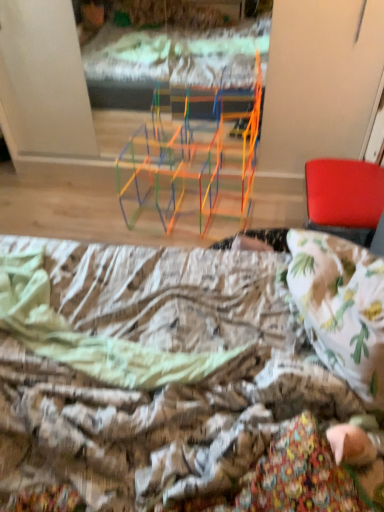
Image resolution: width=384 pixels, height=512 pixels. What are the coordinates of `red leather chair at right` in the screenshot? It's located at (344, 198).

What do you see at coordinates (344, 198) in the screenshot? I see `red leather chair at right` at bounding box center [344, 198].

What do you see at coordinates (165, 383) in the screenshot?
I see `printed fabric bed at lower center` at bounding box center [165, 383].

The image size is (384, 512). What are the coordinates of `printed fabric bed at lower center` in the screenshot? It's located at (165, 383).

At what (x,y) coordinates should I click in order to perform the action: click on red leather chair at right. Please return your answer as a coordinate pair (x, y). Image resolution: width=384 pixels, height=512 pixels. Looking at the image, I should click on (344, 198).

Is red leather chair at right at the left side of printed fabric bed at lower center?

In fact, red leather chair at right is to the right of printed fabric bed at lower center.

Which is in front, red leather chair at right or printed fabric bed at lower center?

printed fabric bed at lower center.

Is point (340, 216) in front of point (301, 355)?

No, (340, 216) is behind (301, 355).

From the image's perspective, between red leather chair at right and printed fabric bed at lower center, who is located below?

printed fabric bed at lower center, from the image's perspective.

From a real-world perspective, is red leather chair at right over printed fabric bed at lower center?

No, from a real-world perspective, red leather chair at right is not over printed fabric bed at lower center

Which of these two, red leather chair at right or printed fabric bed at lower center, is wider?

With larger width is printed fabric bed at lower center.

Who is taller, red leather chair at right or printed fabric bed at lower center?

red leather chair at right is taller.

Is red leather chair at right bigger than printed fabric bed at lower center?

No, red leather chair at right is not bigger than printed fabric bed at lower center.

Is red leather chair at right completely or partially outside of printed fabric bed at lower center?

Absolutely, red leather chair at right is external to printed fabric bed at lower center.

Are red leather chair at right and printed fabric bed at lower center beside each other?

No, red leather chair at right is not making contact with printed fabric bed at lower center.

Could you tell me if red leather chair at right is turned towards printed fabric bed at lower center?

No, red leather chair at right is not aimed at printed fabric bed at lower center.

How different are the orientations of red leather chair at right and printed fabric bed at lower center in degrees?

They differ by 7.71 degrees in their facing directions.

How much distance is there between red leather chair at right and printed fabric bed at lower center?

The distance of red leather chair at right from printed fabric bed at lower center is 28.86 inches.

Locate an element on the screen. Image resolution: width=384 pixels, height=512 pixels. bed in front of the red leather chair at right is located at coordinates (165, 383).

In the scene shown: Considering the positions of objects printed fabric bed at lower center and red leather chair at right in the image provided, who is more to the right, printed fabric bed at lower center or red leather chair at right?

red leather chair at right.

Is printed fabric bed at lower center closer to camera compared to red leather chair at right?

That is True.

Which is behind, point (46, 247) or point (314, 210)?

The point (314, 210) is behind.

Consider the image. From the image's perspective, is printed fabric bed at lower center below red leather chair at right?

Indeed, from the image's perspective, printed fabric bed at lower center is shown beneath red leather chair at right.

From a real-world perspective, which is physically above, printed fabric bed at lower center or red leather chair at right?

printed fabric bed at lower center is physically above.

Which object is thinner, printed fabric bed at lower center or red leather chair at right?

Thinner between the two is red leather chair at right.

Considering the sizes of printed fabric bed at lower center and red leather chair at right in the image, is printed fabric bed at lower center taller or shorter than red leather chair at right?

Clearly, printed fabric bed at lower center is shorter compared to red leather chair at right.

Considering the sizes of objects printed fabric bed at lower center and red leather chair at right in the image provided, who is bigger, printed fabric bed at lower center or red leather chair at right?

printed fabric bed at lower center.

Is red leather chair at right a part of printed fabric bed at lower center?

No, red leather chair at right is not surrounded by printed fabric bed at lower center.

In the scene shown: Is printed fabric bed at lower center placed right next to red leather chair at right?

No, printed fabric bed at lower center is not touching red leather chair at right.

Is printed fabric bed at lower center oriented towards red leather chair at right?

No, printed fabric bed at lower center does not turn towards red leather chair at right.

Can you tell me how much printed fabric bed at lower center and red leather chair at right differ in facing direction?

The angular difference between printed fabric bed at lower center and red leather chair at right is 7.71 degrees.

Find the location of `bed that appears on the left of red leather chair at right`. bed that appears on the left of red leather chair at right is located at coordinates (165, 383).

Locate an element on the screen. This screenshot has height=512, width=384. bed on the left of red leather chair at right is located at coordinates (165, 383).

Identify the location of chair above the printed fabric bed at lower center (from the image's perspective). The image size is (384, 512). (344, 198).